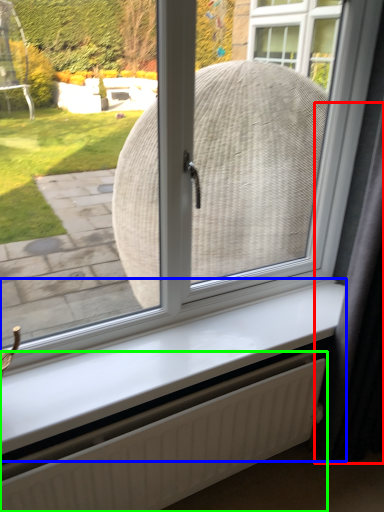
Question: Estimate the real-world distances between objects in this image. Which object is closer to curtain (highlighted by a red box), window sill (highlighted by a blue box) or radiator (highlighted by a green box)?

Choices:
 (A) window sill
 (B) radiator

Answer: (A)